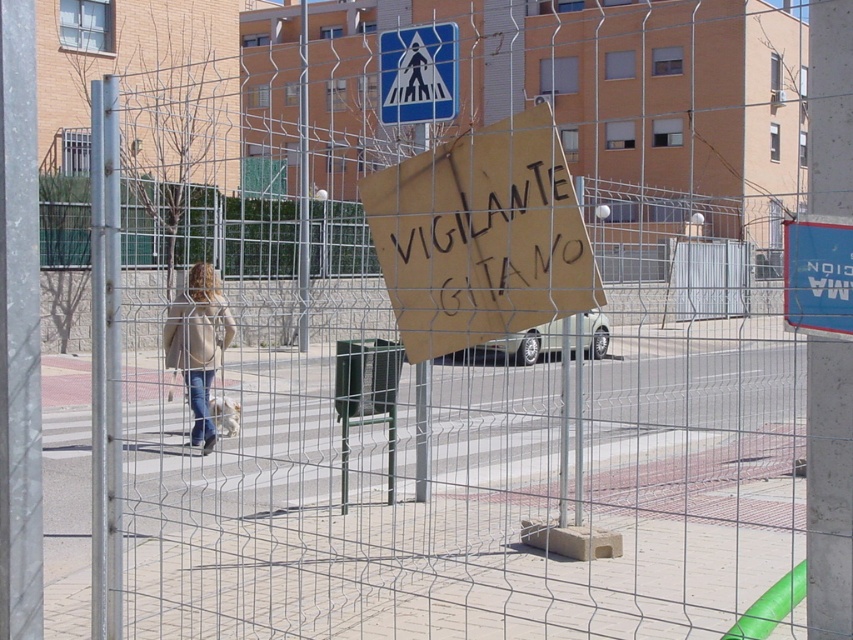
You are standing at the point with coordinates 0.5, 0.25 in the image. You want to walk to the light beige jacket at center. Which direction should you move? Please answer with either north, south, east, or west.

The light beige jacket at center is located at point (198, 342). Your current position is at (212, 320). To reach it, you should move north because the jacket is north of your current position.

You are a delivery robot with a 3 feet wide package. You need to pass through the space between the blue plastic sign at upper right and the camera. Can you fit through the space?

The blue plastic sign at upper right and camera are 10.17 feet apart, so yes, the delivery robot with a 3 feet wide package can fit through the space between them since the distance is wider than the package.